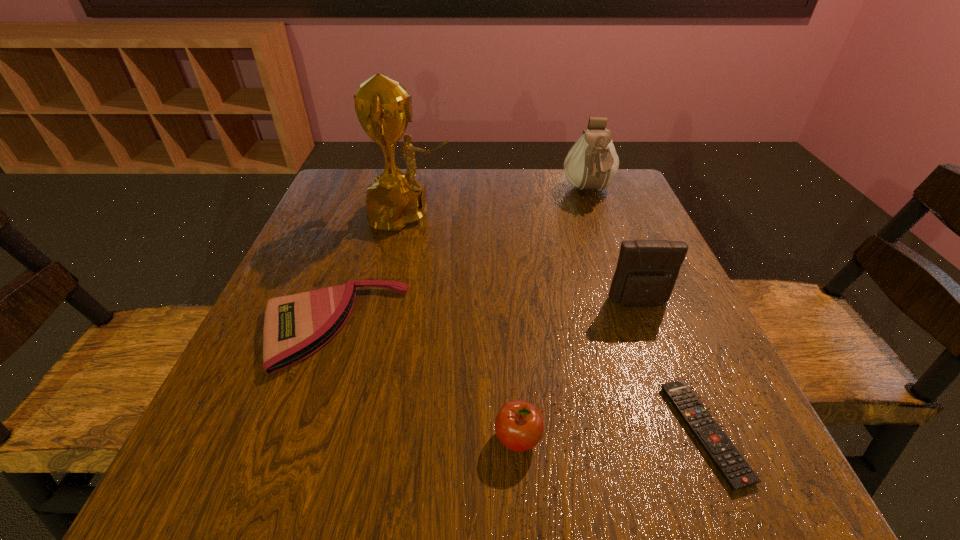
In order to click on wristlet located at the left edge in this screenshot , I will do tap(295, 326).

At what (x,y) coordinates should I click in order to perform the action: click on remote control that is at the right edge. Please return your answer as a coordinate pair (x, y). The image size is (960, 540). Looking at the image, I should click on (735, 470).

Locate an element on the screen. object that is at the far left corner is located at coordinates (383, 107).

Identify the location of object at the far right corner. The width and height of the screenshot is (960, 540). (592, 163).

Where is `object that is at the near right corner`? The height and width of the screenshot is (540, 960). object that is at the near right corner is located at coordinates (735, 470).

At what (x,y) coordinates should I click in order to perform the action: click on vacant space at the far edge of the desktop. Please return your answer as a coordinate pair (x, y). Looking at the image, I should click on (452, 191).

What are the coordinates of `vacant space at the near edge of the desktop` in the screenshot? It's located at (594, 491).

Locate an element on the screen. vacant area at the left edge of the desktop is located at coordinates (367, 258).

Image resolution: width=960 pixels, height=540 pixels. I want to click on vacant region at the far left corner of the desktop, so [313, 214].

This screenshot has width=960, height=540. What are the coordinates of `vacant area that lies between the taller pouch and the award` in the screenshot? It's located at (499, 202).